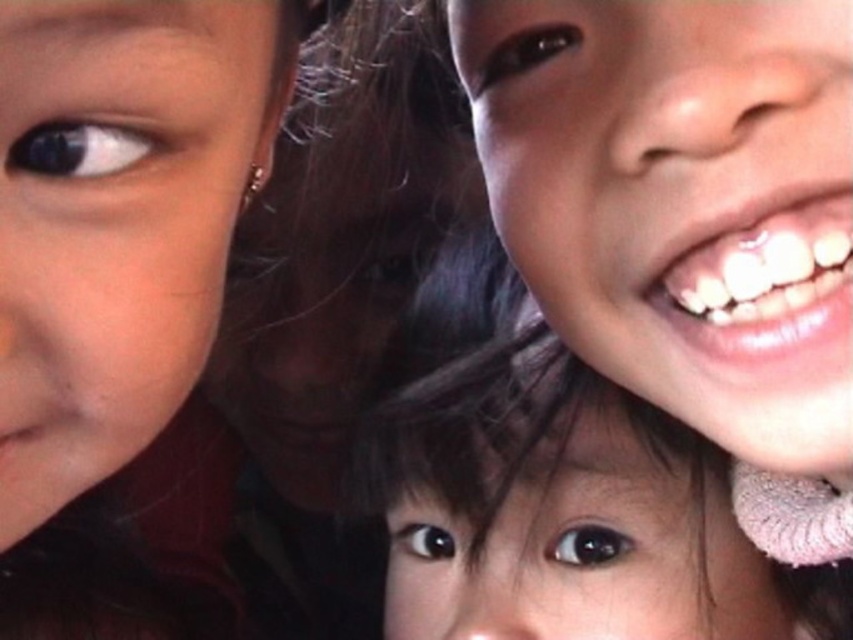
Question: Can you confirm if matte skin at left is positioned above brown matte hair at lower center?

Choices:
 (A) yes
 (B) no

Answer: (A)

Question: Does smooth skin child at center lie in front of brown matte hair at lower center?

Choices:
 (A) yes
 (B) no

Answer: (A)

Question: Among these points, which one is nearest to the camera?

Choices:
 (A) (393, 484)
 (B) (39, 492)
 (C) (729, 221)
 (D) (695, 307)

Answer: (B)

Question: Is smooth skin face at right positioned at the back of white glossy teeth at upper right?

Choices:
 (A) no
 (B) yes

Answer: (A)

Question: Which of the following is the closest to the observer?

Choices:
 (A) (112, 12)
 (B) (540, 20)
 (C) (780, 289)
 (D) (728, 493)

Answer: (A)

Question: Which object is positioned farthest from the white glossy teeth at upper right?

Choices:
 (A) brown matte hair at lower center
 (B) matte skin at left
 (C) smooth skin child at center

Answer: (C)